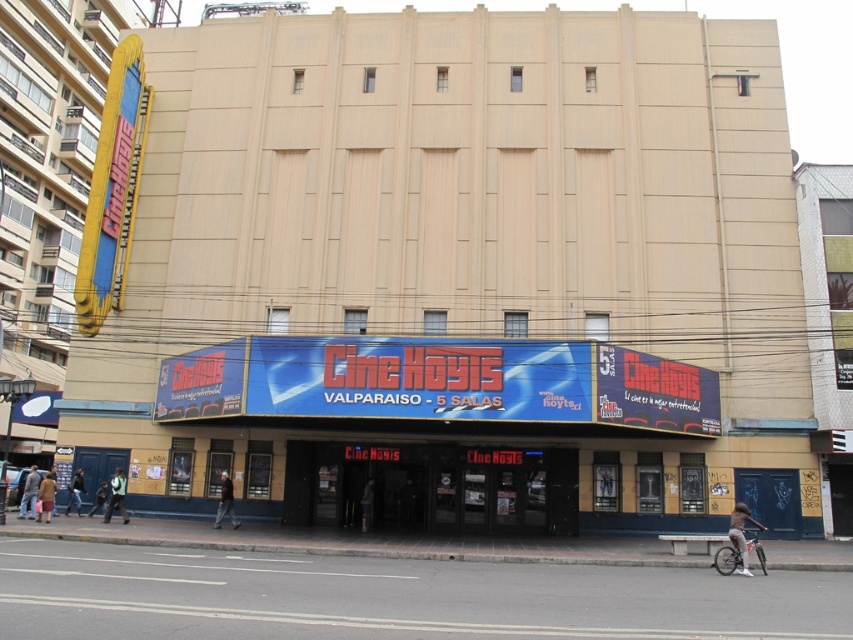
What do you see at coordinates (115, 497) in the screenshot?
I see `green fabric jacket at lower left` at bounding box center [115, 497].

Between green fabric jacket at lower left and light brown leather jacket at lower center, which one is positioned lower?

light brown leather jacket at lower center is below.

Between point (115, 468) and point (222, 492), which one is positioned behind?

The point (115, 468) is more distant.

Where is `green fabric jacket at lower left`? green fabric jacket at lower left is located at coordinates (115, 497).

Is light brown leather jacket at lower center positioned before light brown leather jacket at lower left?

Yes, light brown leather jacket at lower center is in front of light brown leather jacket at lower left.

Is point (225, 488) behind point (33, 499)?

That is False.

Locate an element on the screen. The image size is (853, 640). light brown leather jacket at lower center is located at coordinates (225, 502).

Image resolution: width=853 pixels, height=640 pixels. I want to click on light brown leather jacket at lower left, so click(x=28, y=492).

Is point (28, 502) closer to viewer compared to point (364, 516)?

Yes, it is.

Identify the location of light brown leather jacket at lower left. (28, 492).